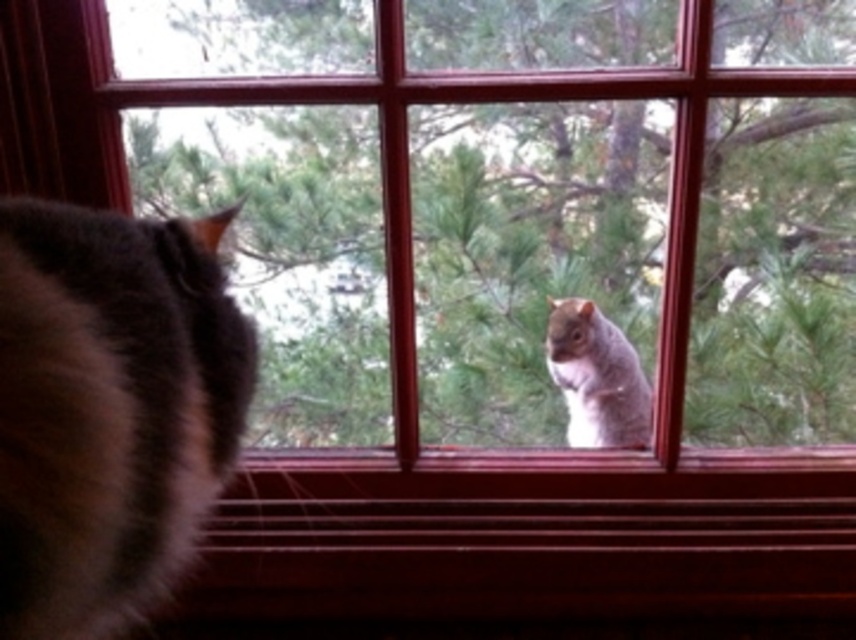
Question: From the image, what is the correct spatial relationship of brown fluffy cat at left in relation to gray furry squirrel at upper center?

Choices:
 (A) below
 (B) above

Answer: (B)

Question: Does green leafy tree at center appear under gray furry squirrel at upper center?

Choices:
 (A) no
 (B) yes

Answer: (A)

Question: Does brown fluffy cat at left lie in front of gray furry squirrel at upper center?

Choices:
 (A) yes
 (B) no

Answer: (A)

Question: Among these objects, which one is farthest from the camera?

Choices:
 (A) green leafy tree at center
 (B) gray furry squirrel at upper center
 (C) brown fluffy cat at left

Answer: (B)

Question: Which point appears farthest from the camera in this image?

Choices:
 (A) (135, 256)
 (B) (440, 138)
 (C) (626, 378)

Answer: (B)

Question: Which of the following is the farthest from the observer?

Choices:
 (A) (792, 74)
 (B) (162, 504)

Answer: (A)